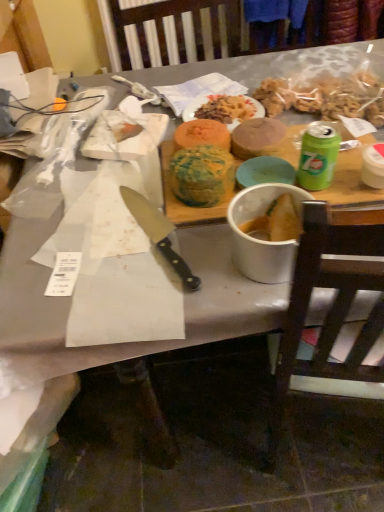
Identify the location of free region on the left part of black plastic knife at center. (69, 252).